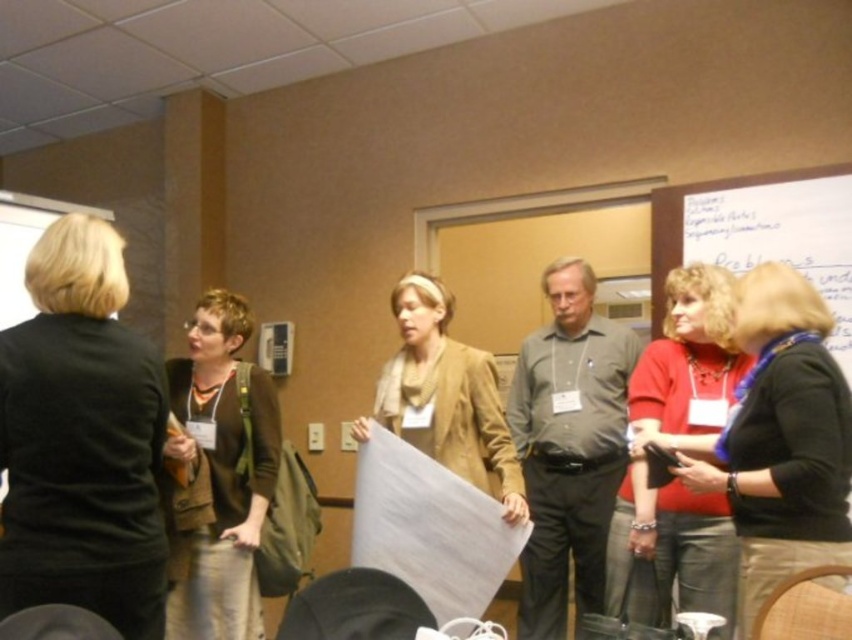
You are standing in the conference room and want to walk from the point at coordinates (x=262, y=413) to the point at coordinates (x=485, y=438). Can you walk directly between these two points without any obstacles?

Point (x=262, y=413) is behind point (x=485, y=438), so you cannot walk directly between them without moving around the obstacle in front.